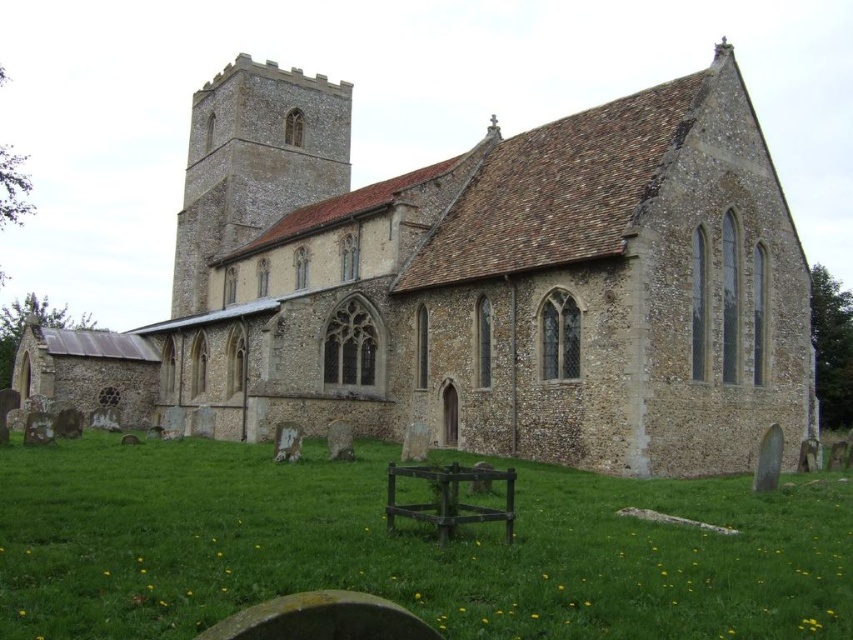
You are standing in the graveyard in front of the brown stone church at center. If you face the church, which direction should you walk to reach the gravestones located to the left side of the church?

Since the brown stone church at center is located at point 0.447 on the x and y coordinates, the gravestones to the left would be positioned to the west of the church. Therefore, you should walk westward to reach them.